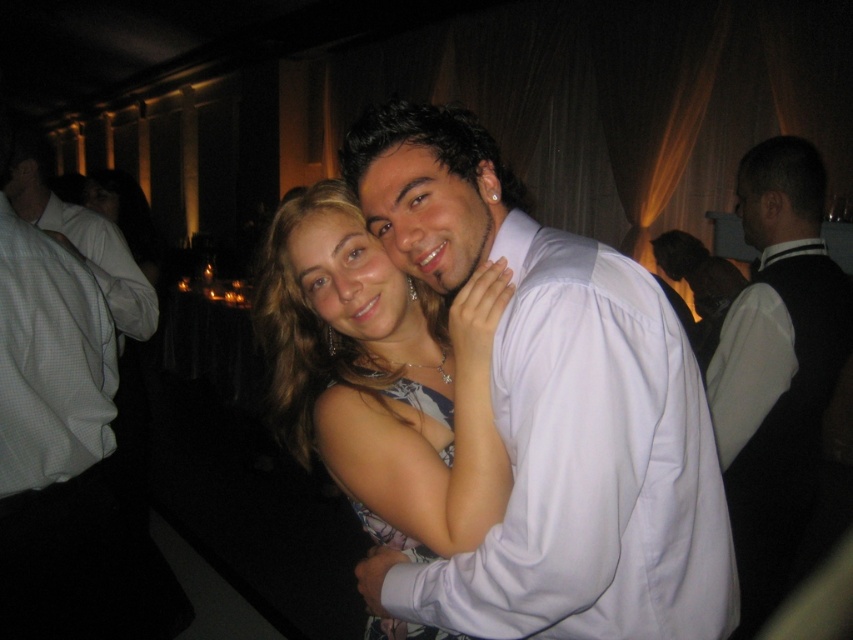
Does white satin shirt at center appear over floral print fabric dress at center?

Yes, white satin shirt at center is above floral print fabric dress at center.

Which is more to the right, white satin shirt at center or floral print fabric dress at center?

white satin shirt at center is more to the right.

Does point (509, 506) come in front of point (376, 636)?

Yes, it is in front of point (376, 636).

Find the location of a particular element. The height and width of the screenshot is (640, 853). white satin shirt at center is located at coordinates (554, 410).

At what (x,y) coordinates should I click in order to perform the action: click on white satin shirt at center. Please return your answer as a coordinate pair (x, y). Image resolution: width=853 pixels, height=640 pixels. Looking at the image, I should click on (554, 410).

Between white satin shirt at center and matte silver necklace at center, which one is positioned lower?

matte silver necklace at center is below.

The height and width of the screenshot is (640, 853). What do you see at coordinates (554, 410) in the screenshot? I see `white satin shirt at center` at bounding box center [554, 410].

I want to click on white satin shirt at center, so click(554, 410).

Measure the distance between matte silver necklace at center and black velvet vest at right.

A distance of 35.12 inches exists between matte silver necklace at center and black velvet vest at right.

Does matte silver necklace at center have a lesser width compared to black velvet vest at right?

No, matte silver necklace at center is not thinner than black velvet vest at right.

Where is `matte silver necklace at center`? This screenshot has height=640, width=853. matte silver necklace at center is located at coordinates (x=381, y=376).